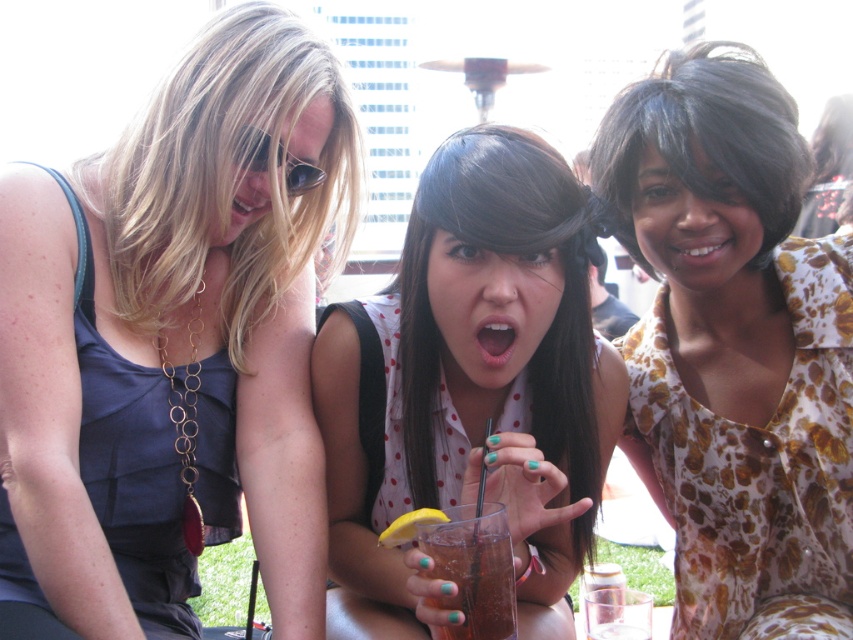
Can you confirm if teethsmoothmouth at center is positioned above matte skin at center?

No, teethsmoothmouth at center is not above matte skin at center.

Who is more forward, (492,353) or (262,202)?

Point (492,353) is in front.

The width and height of the screenshot is (853, 640). What do you see at coordinates (495, 339) in the screenshot?
I see `teethsmoothmouth at center` at bounding box center [495, 339].

Locate an element on the screen. The width and height of the screenshot is (853, 640). teethsmoothmouth at center is located at coordinates (495, 339).

Who is taller, polka dot blouse at center or translucent glass drink at center?

polka dot blouse at center

Does point (397, 627) come closer to viewer compared to point (457, 556)?

No, it is behind (457, 556).

Is point (438, 586) less distant than point (456, 580)?

That is False.

Find the location of `polka dot blouse at center`. polka dot blouse at center is located at coordinates coord(471,388).

Between polka dot blouse at center and teethsmoothmouth at center, which one is positioned lower?

polka dot blouse at center is below.

Is point (596, 413) closer to camera compared to point (523, 362)?

No, (596, 413) is behind (523, 362).

Locate an element on the screen. The width and height of the screenshot is (853, 640). polka dot blouse at center is located at coordinates [x=471, y=388].